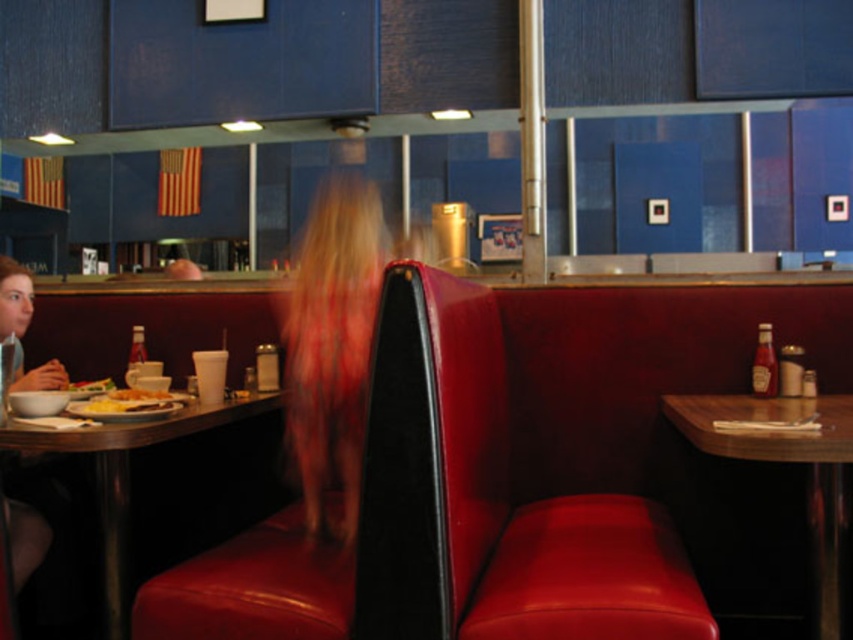
You are a customer in a diner and want to reach the wooden table at right without disturbing the person sitting there. The blurred blonde hair at center belongs to that person. Which direction should you approach from to avoid their line of sight?

Since the blurred blonde hair at center is located above the wooden table at right, approaching from the side opposite to the person would allow you to avoid their line of sight. The wooden table at right is positioned such that the person is facing away from one side, so approaching from that side would be less intrusive.

You are a diner customer who just entered the booth. You want to place your phone on the closest surface to you. Which object from the matte plastic table at left and golden crispy hash browns at left should you choose?

The matte plastic table at left is closer to the viewer than the golden crispy hash browns at left, so you should place your phone on the matte plastic table at left.